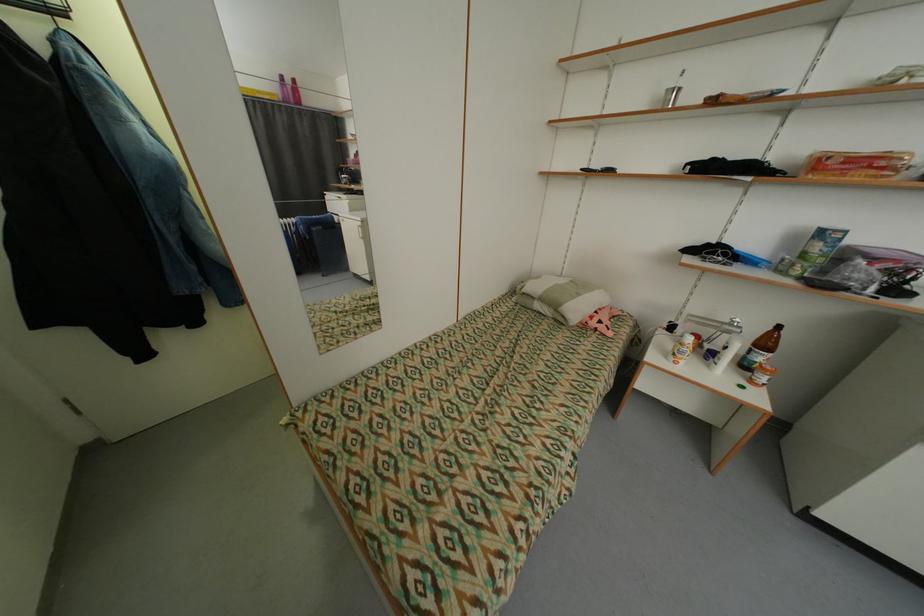
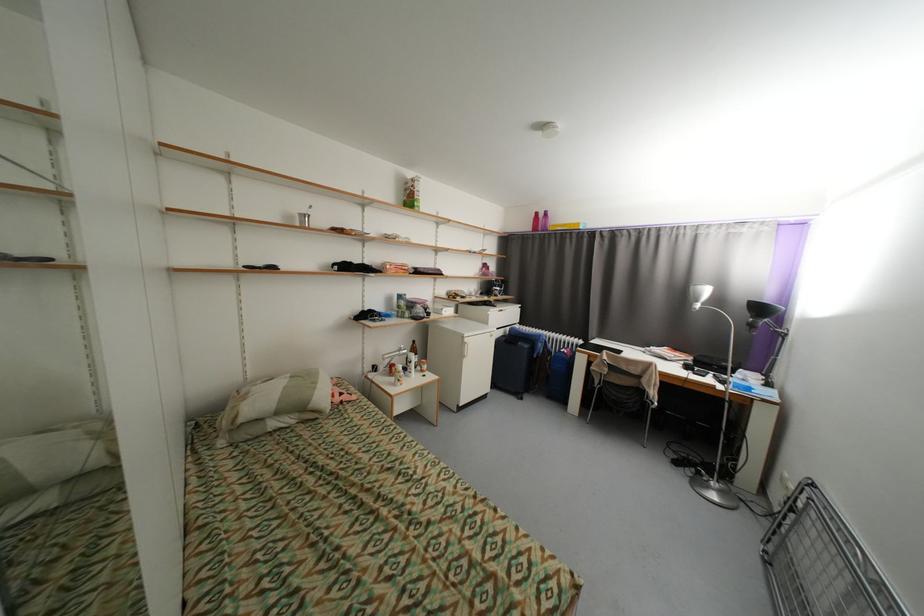
Question: The camera is either moving clockwise (left) or counter-clockwise (right) around the object. The first image is from the beginning of the video and the second image is from the end. Is the camera moving left or right when shooting the video?

Choices:
 (A) Left
 (B) Right

Answer: (A)